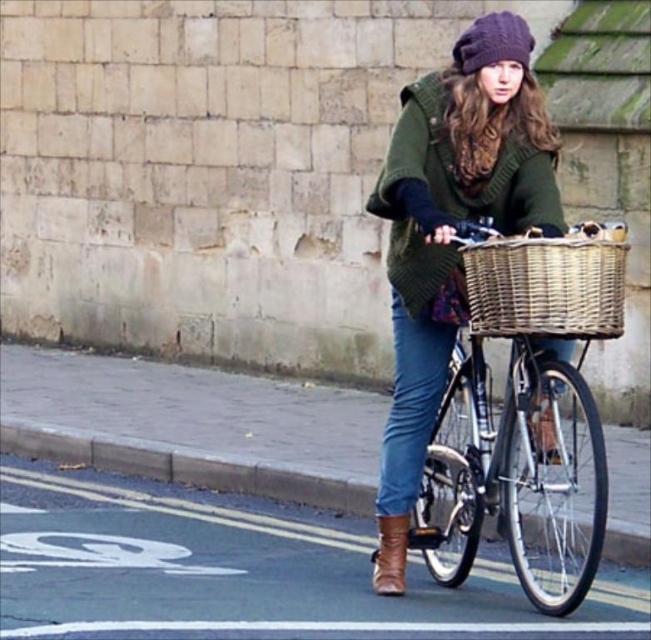
Question: Can you confirm if matte wicker basket at center is bigger than woven wicker basket at center?

Choices:
 (A) no
 (B) yes

Answer: (B)

Question: Considering the relative positions of matte wicker basket at center and woven wicker basket at center in the image provided, where is matte wicker basket at center located with respect to woven wicker basket at center?

Choices:
 (A) left
 (B) right

Answer: (B)

Question: Which object is positioned closest to the matte wicker basket at center?

Choices:
 (A) denim jeans at lower center
 (B) knitted purple hat at upper center
 (C) woven wicker basket at center

Answer: (C)

Question: Can you confirm if matte wicker basket at center is positioned to the right of woven wicker basket at center?

Choices:
 (A) no
 (B) yes

Answer: (B)

Question: Which of these objects is positioned farthest from the matte wicker basket at center?

Choices:
 (A) woven wicker basket at center
 (B) knitted purple hat at upper center

Answer: (B)

Question: Which point is closer to the camera?

Choices:
 (A) (482, 29)
 (B) (486, 300)
 (C) (596, 282)

Answer: (C)